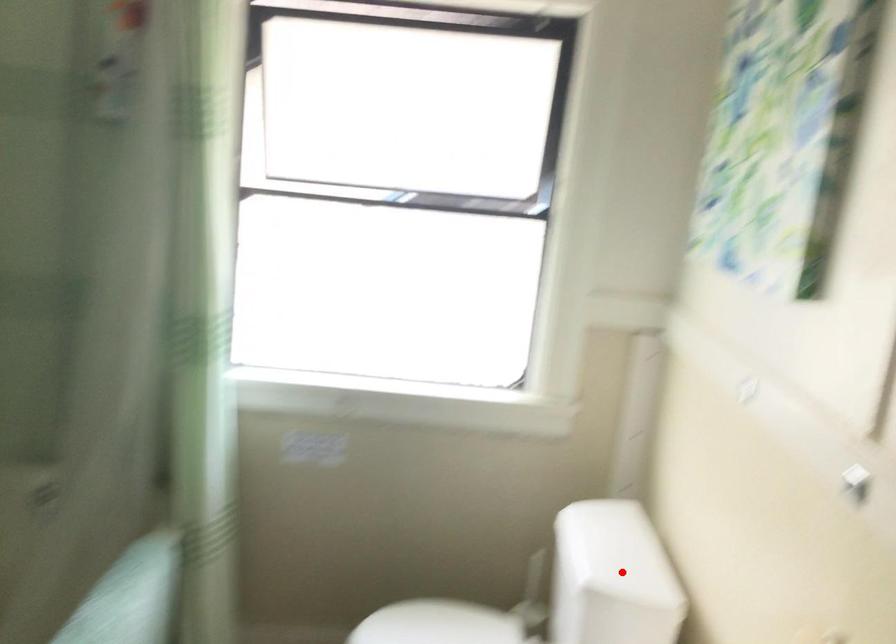
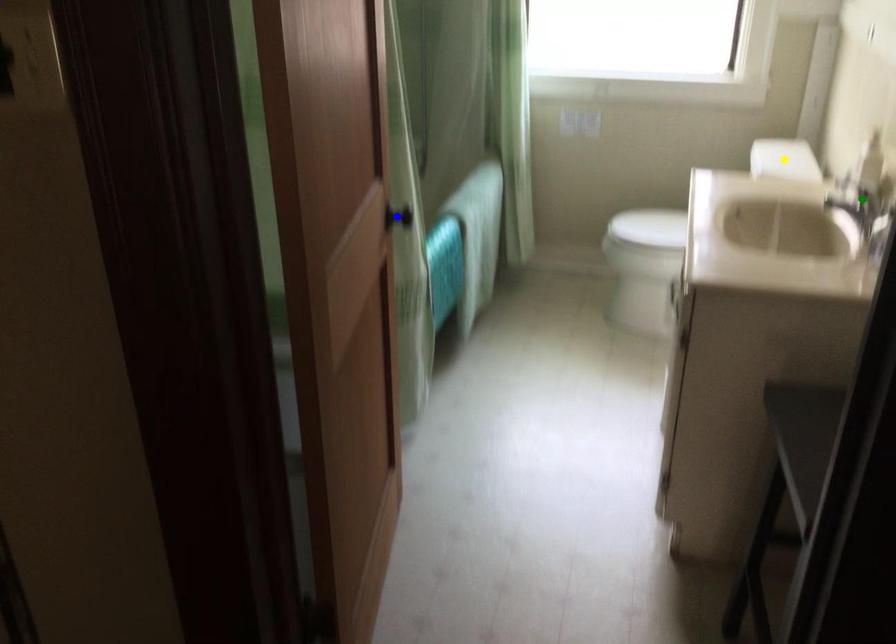
Question: I am providing you with two images of the same scene from different viewpoints. A red point is marked on the first image. You are given multiple points on the second image. Which mark in image 2 goes with the point in image 1?

Choices:
 (A) yellow point
 (B) green point
 (C) blue point

Answer: (A)